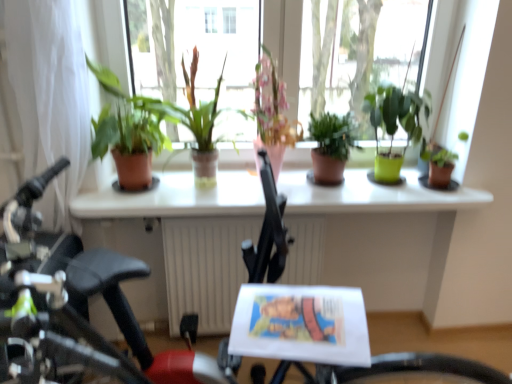
Question: Can you confirm if white sheer curtain at left is taller than terracotta pot at center, acting as the 2th houseplant starting from the left?

Choices:
 (A) yes
 (B) no

Answer: (A)

Question: Can you confirm if white sheer curtain at left is wider than terracotta pot at center, acting as the 2th houseplant starting from the left?

Choices:
 (A) no
 (B) yes

Answer: (A)

Question: From a real-world perspective, is white sheer curtain at left located beneath terracotta pot at center, which ranks as the 5th houseplant in right-to-left order?

Choices:
 (A) no
 (B) yes

Answer: (B)

Question: Can you confirm if white sheer curtain at left is smaller than terracotta pot at center, acting as the 2th houseplant starting from the left?

Choices:
 (A) no
 (B) yes

Answer: (A)

Question: Is white sheer curtain at left to the right of terracotta pot at center, acting as the 2th houseplant starting from the left, from the viewer's perspective?

Choices:
 (A) no
 (B) yes

Answer: (A)

Question: Do you think terracotta pot at center, which ranks as the 5th houseplant in right-to-left order, is within matte terracotta pot at left, which appears as the first houseplant when viewed from the left, or outside of it?

Choices:
 (A) outside
 (B) inside

Answer: (A)

Question: From a real-world perspective, is terracotta pot at center, acting as the 2th houseplant starting from the left, positioned above or below matte terracotta pot at left, positioned as the 6th houseplant in right-to-left order?

Choices:
 (A) below
 (B) above

Answer: (B)

Question: Considering the relative positions of terracotta pot at center, which ranks as the 5th houseplant in right-to-left order, and matte terracotta pot at left, positioned as the 6th houseplant in right-to-left order, in the image provided, is terracotta pot at center, which ranks as the 5th houseplant in right-to-left order, to the left or to the right of matte terracotta pot at left, positioned as the 6th houseplant in right-to-left order,?

Choices:
 (A) right
 (B) left

Answer: (A)

Question: From the image's perspective, is terracotta pot at center, acting as the 2th houseplant starting from the left, positioned above or below matte terracotta pot at left, positioned as the 6th houseplant in right-to-left order?

Choices:
 (A) below
 (B) above

Answer: (B)

Question: From the image's perspective, is green matte plant at right, which is the 6th houseplant in left-to-right order, above or below white glossy window sill at center?

Choices:
 (A) above
 (B) below

Answer: (A)

Question: Considering the positions of green matte plant at right, positioned as the 1th houseplant in right-to-left order, and white glossy window sill at center in the image, is green matte plant at right, positioned as the 1th houseplant in right-to-left order, bigger or smaller than white glossy window sill at center?

Choices:
 (A) small
 (B) big

Answer: (A)

Question: From a real-world perspective, is green matte plant at right, which is the 6th houseplant in left-to-right order, positioned above or below white glossy window sill at center?

Choices:
 (A) above
 (B) below

Answer: (A)

Question: Considering their positions, is green matte plant at right, which is the 6th houseplant in left-to-right order, located in front of or behind white glossy window sill at center?

Choices:
 (A) front
 (B) behind

Answer: (B)

Question: Does point (254, 188) appear closer or farther from the camera than point (18, 72)?

Choices:
 (A) closer
 (B) farther

Answer: (B)

Question: In terms of size, does white glossy table at center appear bigger or smaller than white sheer curtain at left?

Choices:
 (A) small
 (B) big

Answer: (B)